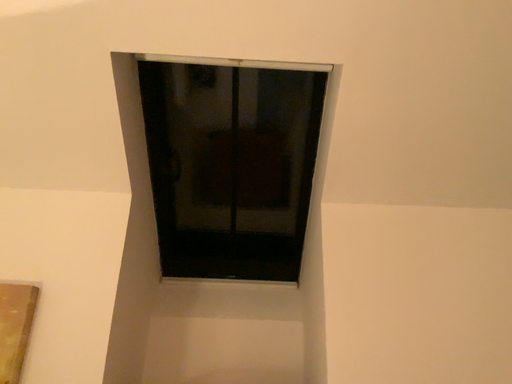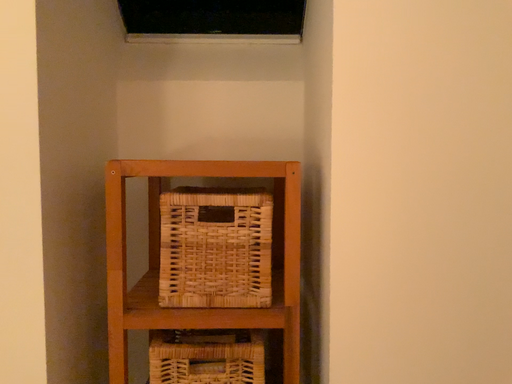
Question: How did the camera likely rotate when shooting the video?

Choices:
 (A) rotated downward
 (B) rotated upward

Answer: (A)